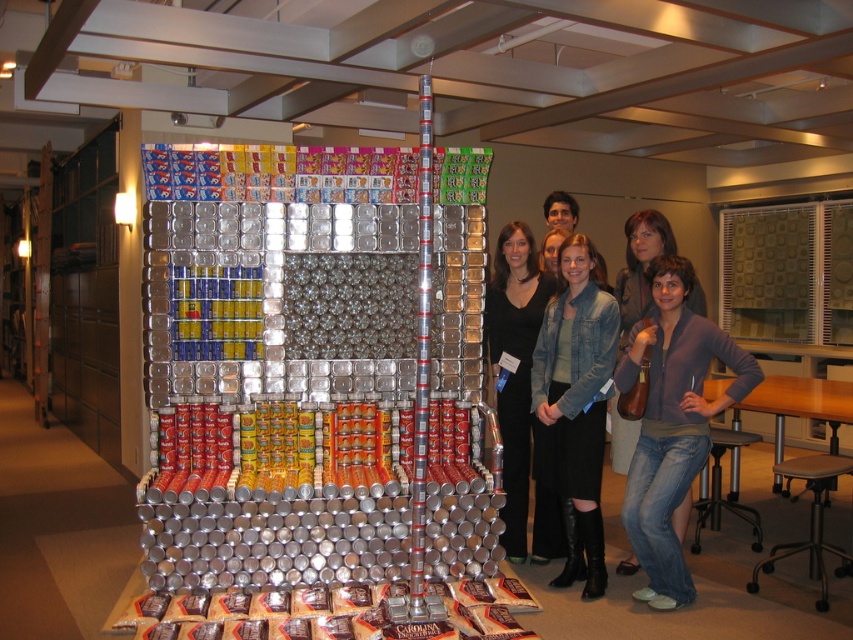
Question: Where is denim jacket at lower right located in relation to black dress at center in the image?

Choices:
 (A) left
 (B) right

Answer: (B)

Question: Is black dress at center above denim jeans at lower right?

Choices:
 (A) yes
 (B) no

Answer: (B)

Question: Which point appears farthest from the camera in this image?

Choices:
 (A) (637, 269)
 (B) (529, 424)

Answer: (B)

Question: Can you confirm if denim jacket at lower right is positioned to the left of black dress at center?

Choices:
 (A) yes
 (B) no

Answer: (B)

Question: Considering the real-world distances, which object is farthest from the denim jeans at lower right?

Choices:
 (A) denim jacket at lower right
 (B) black dress at center

Answer: (B)

Question: Which of the following is the farthest from the observer?

Choices:
 (A) denim jeans at lower right
 (B) denim jacket at lower right

Answer: (A)